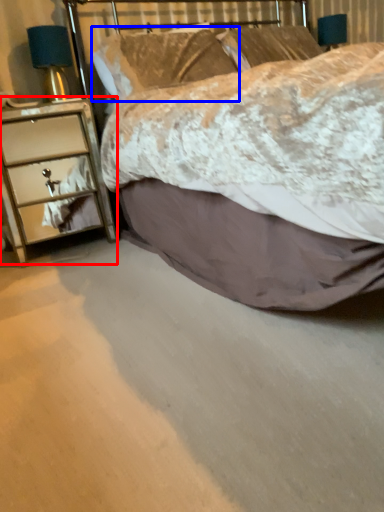
Question: Which of the following is the closest to the observer, chest of drawers (highlighted by a red box) or pillow (highlighted by a blue box)?

Choices:
 (A) chest of drawers
 (B) pillow

Answer: (A)